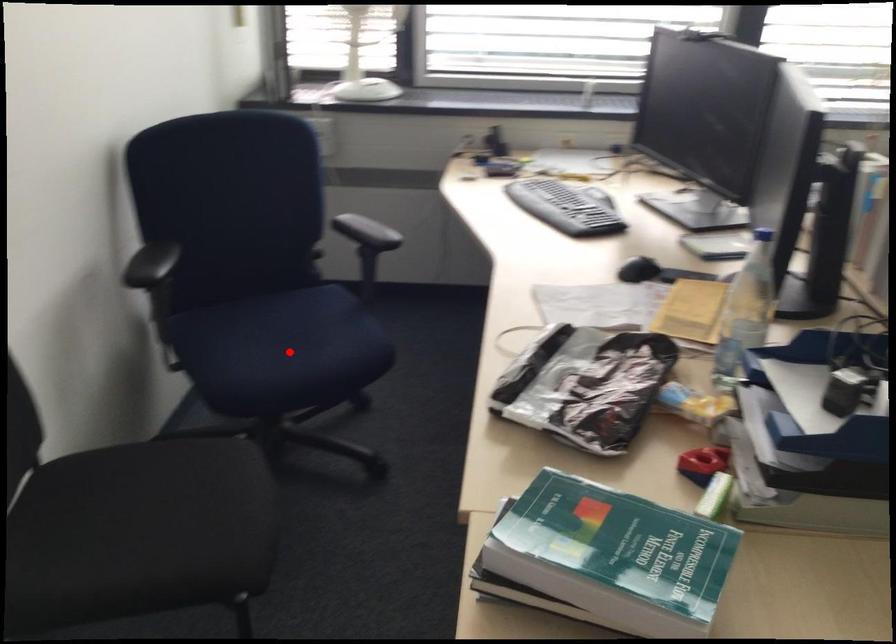
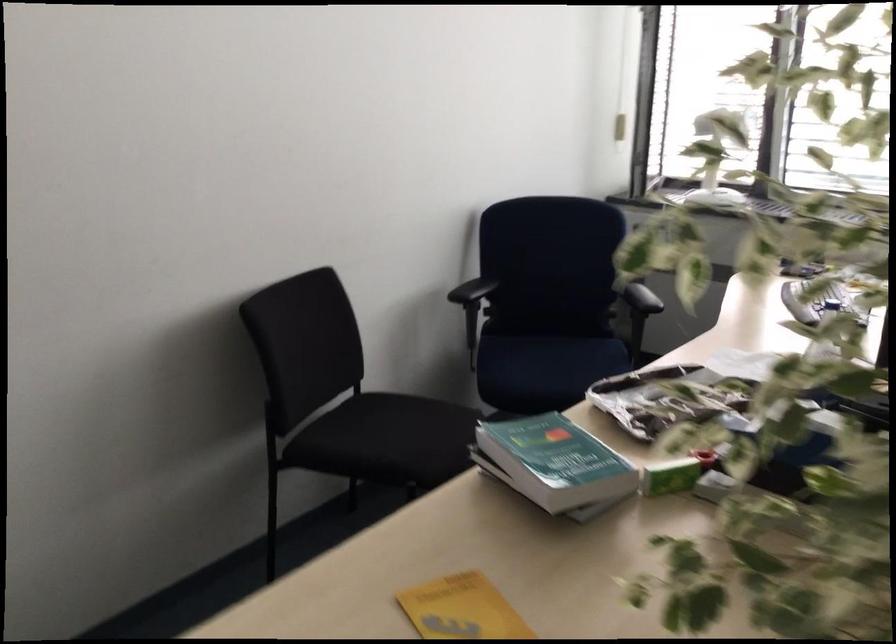
Question: I am providing you with two images of the same scene from different viewpoints. A red point is marked on the first image. At the location where the point appears in image 1, is it still visible in image 2?

Choices:
 (A) Yes
 (B) No

Answer: (A)